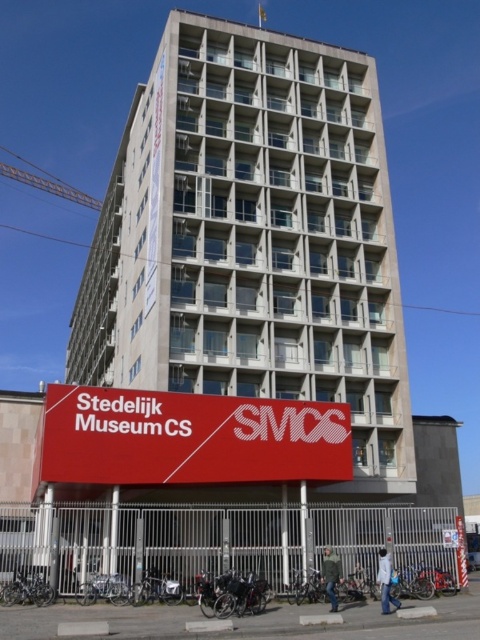
Question: Which point appears closest to the camera in this image?

Choices:
 (A) (190, 406)
 (B) (338, 243)

Answer: (A)

Question: Which point appears farthest from the camera in this image?

Choices:
 (A) [232, 420]
 (B) [164, 67]

Answer: (B)

Question: Can you confirm if concrete building at center is smaller than red matte sign at lower center?

Choices:
 (A) yes
 (B) no

Answer: (B)

Question: Does concrete building at center appear under red matte sign at lower center?

Choices:
 (A) no
 (B) yes

Answer: (A)

Question: Can you confirm if concrete building at center is positioned above red matte sign at lower center?

Choices:
 (A) no
 (B) yes

Answer: (B)